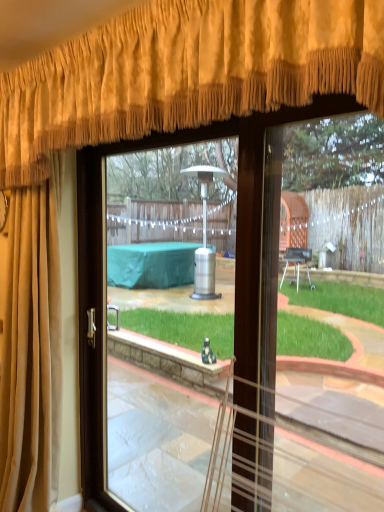
This screenshot has width=384, height=512. In order to click on suede-like beige curtain at upper left, the first curtain in the bottom-to-top sequence in this screenshot , I will do `click(32, 350)`.

How much space does gold velvet curtain at upper center, which is the first curtain from top to bottom, occupy vertically?

gold velvet curtain at upper center, which is the first curtain from top to bottom, is 21.06 inches tall.

This screenshot has height=512, width=384. What do you see at coordinates (104, 296) in the screenshot?
I see `clear glass door at center` at bounding box center [104, 296].

Locate an element on the screen. This screenshot has width=384, height=512. suede-like beige curtain at upper left, the second curtain when ordered from top to bottom is located at coordinates (32, 350).

Which is more to the right, gold velvet curtain at upper center, which is the first curtain from top to bottom, or suede-like beige curtain at upper left, the second curtain when ordered from top to bottom?

gold velvet curtain at upper center, which is the first curtain from top to bottom, is more to the right.

Is gold velvet curtain at upper center, which is the first curtain from top to bottom, turned away from suede-like beige curtain at upper left, the second curtain when ordered from top to bottom?

No, gold velvet curtain at upper center, which is the first curtain from top to bottom, is not facing the opposite direction of suede-like beige curtain at upper left, the second curtain when ordered from top to bottom.

Between gold velvet curtain at upper center, which is the first curtain from top to bottom, and suede-like beige curtain at upper left, the second curtain when ordered from top to bottom, which one is positioned behind?

suede-like beige curtain at upper left, the second curtain when ordered from top to bottom, is more distant.

How different are the orientations of suede-like beige curtain at upper left, the second curtain when ordered from top to bottom, and clear glass door at center in degrees?

They differ by 2.66 degrees in their facing directions.

Is clear glass door at center a part of suede-like beige curtain at upper left, the first curtain in the bottom-to-top sequence?

No.

Which of these two, suede-like beige curtain at upper left, the first curtain in the bottom-to-top sequence, or clear glass door at center, is smaller?

Smaller between the two is clear glass door at center.

Does suede-like beige curtain at upper left, the second curtain when ordered from top to bottom, appear on the left side of clear glass door at center?

Yes, suede-like beige curtain at upper left, the second curtain when ordered from top to bottom, is to the left of clear glass door at center.

Can you confirm if clear glass door at center is positioned to the left of gold velvet curtain at upper center, which is the first curtain from top to bottom?

No.

From a real-world perspective, between clear glass door at center and gold velvet curtain at upper center, the second curtain positioned from the bottom, who is vertically higher?

In real-world perspective, gold velvet curtain at upper center, the second curtain positioned from the bottom, is above.

Considering the sizes of objects clear glass door at center and gold velvet curtain at upper center, which is the first curtain from top to bottom, in the image provided, who is wider, clear glass door at center or gold velvet curtain at upper center, which is the first curtain from top to bottom,?

Wider between the two is gold velvet curtain at upper center, which is the first curtain from top to bottom.

Is gold velvet curtain at upper center, which is the first curtain from top to bottom, wider than clear glass door at center?

Yes.

Is gold velvet curtain at upper center, the second curtain positioned from the bottom, to the left of clear glass door at center from the viewer's perspective?

Correct, you'll find gold velvet curtain at upper center, the second curtain positioned from the bottom, to the left of clear glass door at center.

Is gold velvet curtain at upper center, the second curtain positioned from the bottom, touching clear glass door at center?

gold velvet curtain at upper center, the second curtain positioned from the bottom, and clear glass door at center are clearly separated.

From a real-world perspective, between gold velvet curtain at upper center, the second curtain positioned from the bottom, and clear glass door at center, who is vertically lower?

clear glass door at center is physically lower.

Is suede-like beige curtain at upper left, the first curtain in the bottom-to-top sequence, thinner than gold velvet curtain at upper center, the second curtain positioned from the bottom?

Yes, suede-like beige curtain at upper left, the first curtain in the bottom-to-top sequence, is thinner than gold velvet curtain at upper center, the second curtain positioned from the bottom.

In the image, is suede-like beige curtain at upper left, the second curtain when ordered from top to bottom, positioned in front of or behind gold velvet curtain at upper center, which is the first curtain from top to bottom?

Visually, suede-like beige curtain at upper left, the second curtain when ordered from top to bottom, is located behind gold velvet curtain at upper center, which is the first curtain from top to bottom.

Find the location of `curtain above the suede-like beige curtain at upper left, the second curtain when ordered from top to bottom (from the image's perspective)`. curtain above the suede-like beige curtain at upper left, the second curtain when ordered from top to bottom (from the image's perspective) is located at coordinates (186, 73).

Which is less distant, (10, 305) or (132, 126)?

Positioned in front is point (132, 126).

Between clear glass door at center and suede-like beige curtain at upper left, the first curtain in the bottom-to-top sequence, which one appears on the left side from the viewer's perspective?

Positioned to the left is suede-like beige curtain at upper left, the first curtain in the bottom-to-top sequence.

From a real-world perspective, is clear glass door at center positioned above or below suede-like beige curtain at upper left, the first curtain in the bottom-to-top sequence?

Clearly, from a real-world perspective, clear glass door at center is below suede-like beige curtain at upper left, the first curtain in the bottom-to-top sequence.

Are clear glass door at center and suede-like beige curtain at upper left, the first curtain in the bottom-to-top sequence, far apart?

clear glass door at center is actually quite close to suede-like beige curtain at upper left, the first curtain in the bottom-to-top sequence.

What are the coordinates of `curtain that appears above the suede-like beige curtain at upper left, the second curtain when ordered from top to bottom (from the image's perspective)` in the screenshot? It's located at (186, 73).

What are the coordinates of `screen door on the right of suede-like beige curtain at upper left, the first curtain in the bottom-to-top sequence` in the screenshot? It's located at (104, 296).

Which object lies further to the anchor point clear glass door at center, suede-like beige curtain at upper left, the second curtain when ordered from top to bottom, or gold velvet curtain at upper center, the second curtain positioned from the bottom?

The object further to clear glass door at center is gold velvet curtain at upper center, the second curtain positioned from the bottom.

Based on their spatial positions, is clear glass door at center or suede-like beige curtain at upper left, the second curtain when ordered from top to bottom, further from gold velvet curtain at upper center, which is the first curtain from top to bottom?

clear glass door at center is positioned further to the anchor gold velvet curtain at upper center, which is the first curtain from top to bottom.

Considering their positions, is suede-like beige curtain at upper left, the second curtain when ordered from top to bottom, positioned further to gold velvet curtain at upper center, the second curtain positioned from the bottom, than clear glass door at center?

Based on the image, clear glass door at center appears to be further to gold velvet curtain at upper center, the second curtain positioned from the bottom.

Considering their positions, is gold velvet curtain at upper center, which is the first curtain from top to bottom, positioned closer to clear glass door at center than suede-like beige curtain at upper left, the first curtain in the bottom-to-top sequence?

Based on the image, suede-like beige curtain at upper left, the first curtain in the bottom-to-top sequence, appears to be nearer to clear glass door at center.

Considering their positions, is clear glass door at center positioned further to suede-like beige curtain at upper left, the second curtain when ordered from top to bottom, than gold velvet curtain at upper center, which is the first curtain from top to bottom?

Among the two, gold velvet curtain at upper center, which is the first curtain from top to bottom, is located further to suede-like beige curtain at upper left, the second curtain when ordered from top to bottom.

When comparing their distances from suede-like beige curtain at upper left, the first curtain in the bottom-to-top sequence, does gold velvet curtain at upper center, the second curtain positioned from the bottom, or clear glass door at center seem closer?

Based on the image, clear glass door at center appears to be nearer to suede-like beige curtain at upper left, the first curtain in the bottom-to-top sequence.

The image size is (384, 512). I want to click on screen door positioned between gold velvet curtain at upper center, which is the first curtain from top to bottom, and suede-like beige curtain at upper left, the first curtain in the bottom-to-top sequence, from near to far, so click(104, 296).